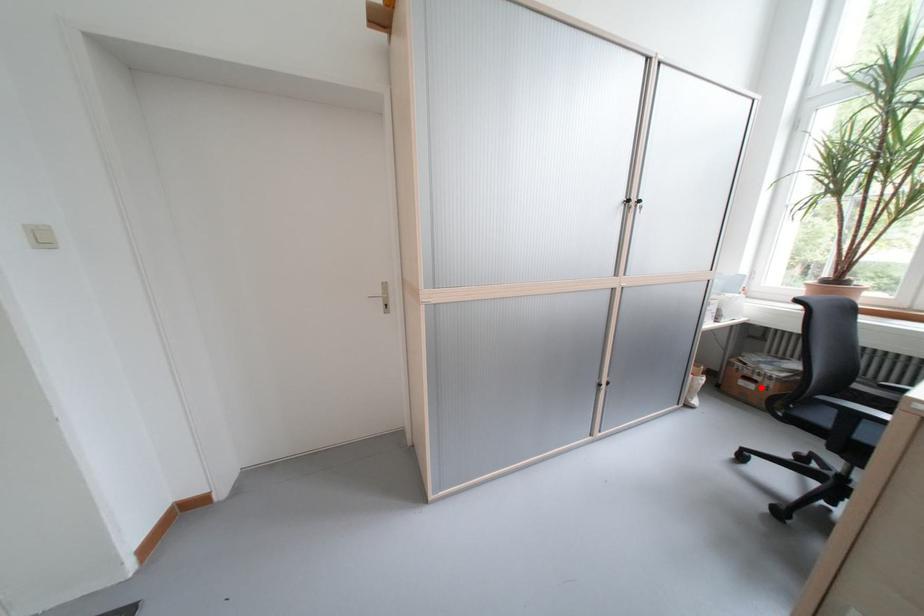
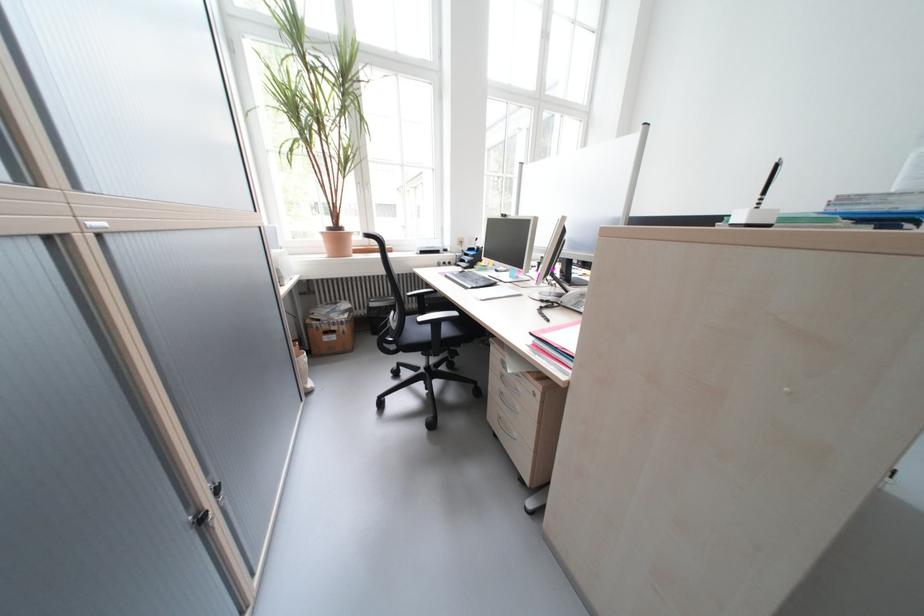
Where in the second image is the point corresponding to the highlighted location from the first image?

(344, 339)